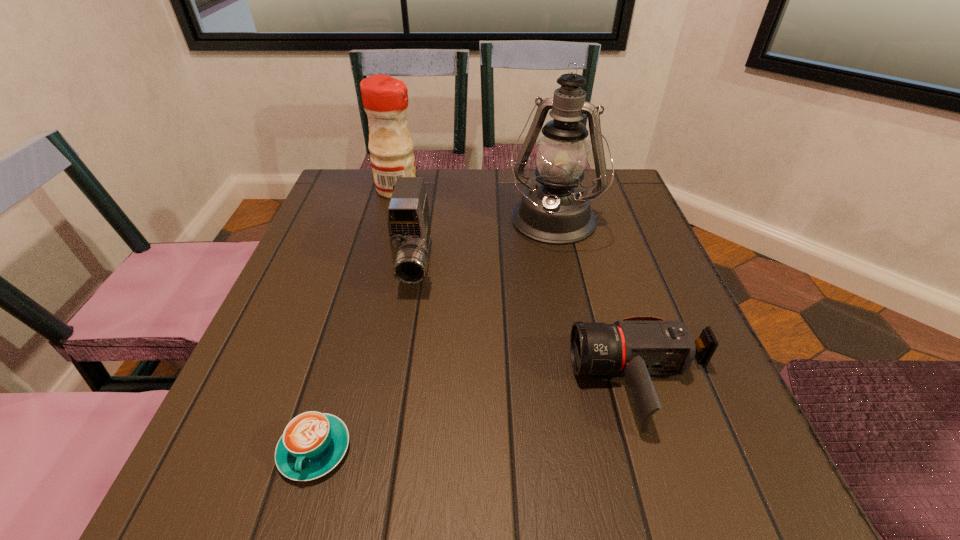
Image resolution: width=960 pixels, height=540 pixels. I want to click on free space between the cappuccino and the condiment, so click(x=356, y=320).

The width and height of the screenshot is (960, 540). Find the location of `blank region between the cappuccino and the fourth shortest object`. blank region between the cappuccino and the fourth shortest object is located at coordinates 356,320.

Find the location of a particular element. The image size is (960, 540). vacant space in between the cappuccino and the taller camcorder is located at coordinates (365, 358).

Identify the location of free space between the fourth tallest object and the farther camcorder. The height and width of the screenshot is (540, 960). click(x=529, y=325).

Find the location of a particular element. The image size is (960, 540). free space between the shorter camcorder and the shortest object is located at coordinates (479, 416).

This screenshot has height=540, width=960. I want to click on free space between the farther camcorder and the fourth tallest object, so (529, 325).

Image resolution: width=960 pixels, height=540 pixels. Find the location of `free space between the shorter camcorder and the taller camcorder`. free space between the shorter camcorder and the taller camcorder is located at coordinates (529, 325).

Locate an element on the screen. The image size is (960, 540). object that is the third closest to the tallest object is located at coordinates (636, 347).

Identify the location of the fourth closest object relative to the condiment. (313, 443).